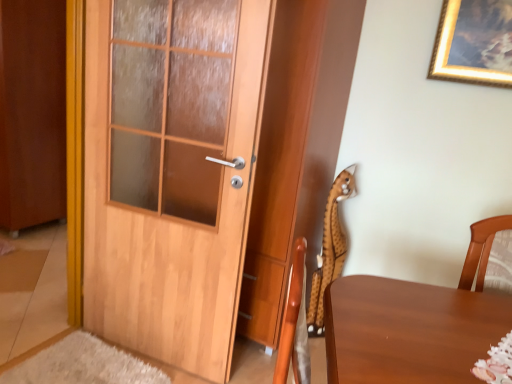
This screenshot has width=512, height=384. Find the location of `spotted plush toy at right`. spotted plush toy at right is located at coordinates (330, 249).

This screenshot has width=512, height=384. Identify the location of spotted plush toy at right. (x=330, y=249).

From a real-world perspective, who is located lower, brown wooden door at left or spotted plush toy at right?

In real-world perspective, spotted plush toy at right is lower.

How different are the orientations of brown wooden door at left and spotted plush toy at right in degrees?

There is a 41-degree angle between the facing directions of brown wooden door at left and spotted plush toy at right.

Which of these two, brown wooden door at left or spotted plush toy at right, is smaller?

With smaller size is spotted plush toy at right.

How many degrees apart are the facing directions of spotted plush toy at right and brown wooden door at left?

spotted plush toy at right and brown wooden door at left are facing 41 degrees away from each other.

Who is smaller, spotted plush toy at right or brown wooden door at left?

With smaller size is spotted plush toy at right.

Looking at this image, who is shorter, spotted plush toy at right or brown wooden door at left?

spotted plush toy at right is shorter.

Which object is positioned more to the left, spotted plush toy at right or brown wooden door at left?

brown wooden door at left is more to the left.

This screenshot has width=512, height=384. Identify the location of barn door above the wooden door at left (from a real-world perspective). (32, 112).

From the image's perspective, is brown wooden door at left located beneath wooden door at left?

No.

Considering the points (63, 70) and (132, 1), which point is behind, point (63, 70) or point (132, 1)?

The point (63, 70) is farther from the camera.

Considering the sizes of objects brown wooden door at left and wooden door at left in the image provided, who is shorter, brown wooden door at left or wooden door at left?

wooden door at left.

From a real-world perspective, between spotted plush toy at right and wooden door at left, who is vertically lower?

In real-world perspective, spotted plush toy at right is lower.

Considering the sizes of objects spotted plush toy at right and wooden door at left in the image provided, who is thinner, spotted plush toy at right or wooden door at left?

spotted plush toy at right is thinner.

Does point (324, 217) appear closer or farther from the camera than point (141, 233)?

Clearly, point (324, 217) is more distant from the camera than point (141, 233).

What's the angular difference between wooden door at left and brown wooden door at left's facing directions?

12.1 degrees separate the facing orientations of wooden door at left and brown wooden door at left.

Does wooden door at left have a greater width compared to brown wooden door at left?

No.

Is point (115, 300) more distant than point (30, 224)?

No, it is in front of (30, 224).

From a real-world perspective, is wooden door at left physically below brown wooden door at left?

Yes, from a real-world perspective, wooden door at left is beneath brown wooden door at left.

Does wooden door at left have a lesser height compared to spotted plush toy at right?

No, wooden door at left is not shorter than spotted plush toy at right.

Considering the relative positions of wooden door at left and spotted plush toy at right in the image provided, is wooden door at left to the left or to the right of spotted plush toy at right?

In the image, wooden door at left appears on the left side of spotted plush toy at right.

How far apart are wooden door at left and spotted plush toy at right?

wooden door at left is 34.77 inches away from spotted plush toy at right.

How different are the orientations of wooden door at left and spotted plush toy at right in degrees?

There is a 28.9-degree angle between the facing directions of wooden door at left and spotted plush toy at right.

Find the location of `barn door that is above the spotted plush toy at right (from a real-world perspective)`. barn door that is above the spotted plush toy at right (from a real-world perspective) is located at coordinates pos(32,112).

At what (x,y) coordinates should I click in order to perform the action: click on barn door lying behind the spotted plush toy at right. Please return your answer as a coordinate pair (x, y). The width and height of the screenshot is (512, 384). Looking at the image, I should click on (32, 112).

When comparing their distances from brown wooden door at left, does spotted plush toy at right or wooden door at left seem closer?

wooden door at left.

Looking at the image, which one is located closer to spotted plush toy at right, wooden door at left or brown wooden door at left?

The object closer to spotted plush toy at right is wooden door at left.

Looking at the image, which one is located further to wooden door at left, brown wooden door at left or spotted plush toy at right?

The object further to wooden door at left is brown wooden door at left.

Considering their positions, is wooden door at left positioned closer to brown wooden door at left than spotted plush toy at right?

Based on the image, wooden door at left appears to be nearer to brown wooden door at left.

Which object lies nearer to the anchor point wooden door at left, spotted plush toy at right or brown wooden door at left?

Based on the image, spotted plush toy at right appears to be nearer to wooden door at left.

Which object lies nearer to the anchor point spotted plush toy at right, brown wooden door at left or wooden door at left?

wooden door at left lies closer to spotted plush toy at right than the other object.

I want to click on door between brown wooden door at left and spotted plush toy at right, so click(x=170, y=173).